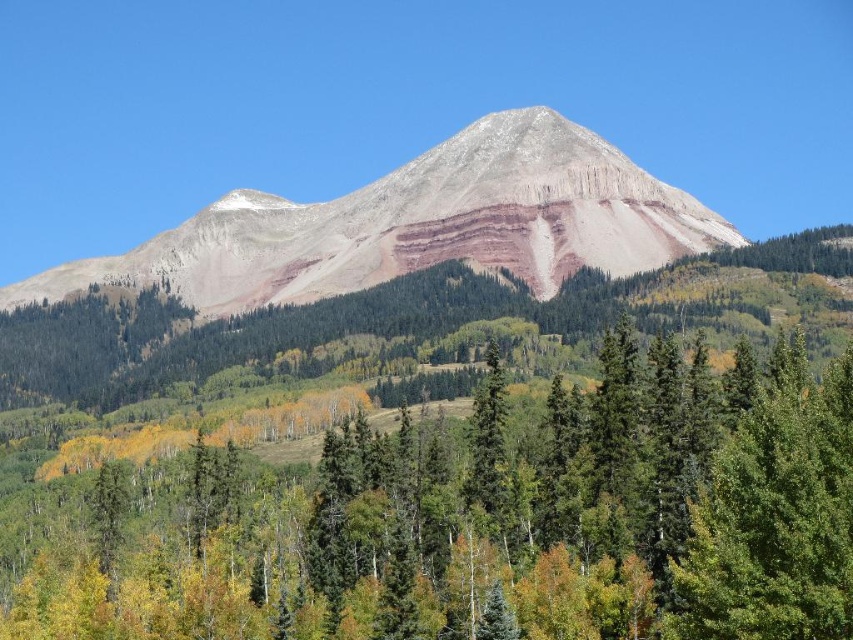
Question: Which point is closer to the camera?

Choices:
 (A) (44, 611)
 (B) (556, 161)

Answer: (A)

Question: Does green matte tree at center have a smaller size compared to rustic rock mountain at center?

Choices:
 (A) yes
 (B) no

Answer: (A)

Question: Among these points, which one is farthest from the camera?

Choices:
 (A) (508, 236)
 (B) (190, 531)

Answer: (A)

Question: Is green matte tree at center bigger than rustic rock mountain at center?

Choices:
 (A) no
 (B) yes

Answer: (A)

Question: Does green matte tree at center have a larger size compared to rustic rock mountain at center?

Choices:
 (A) no
 (B) yes

Answer: (A)